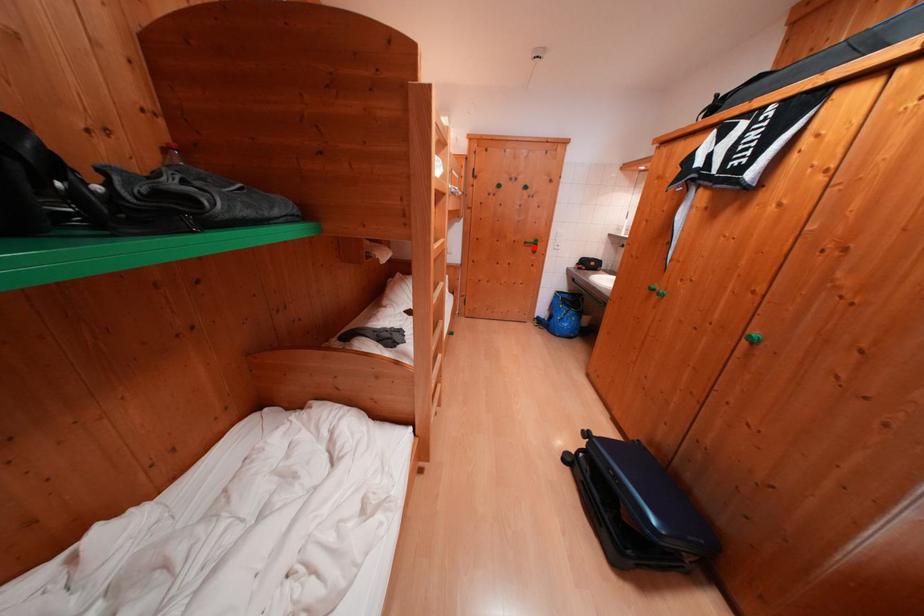
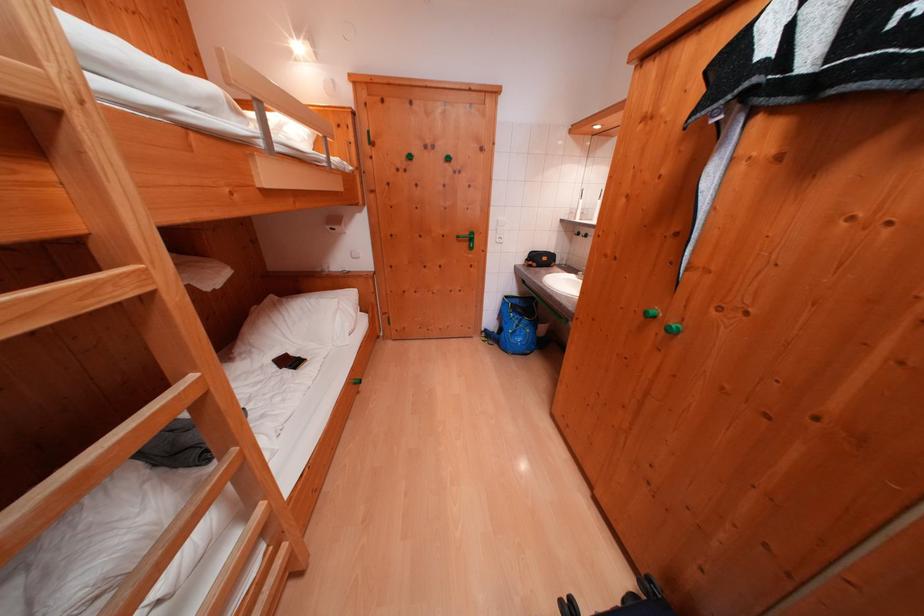
In the second image, find the point that corresponds to the highlighted location in the first image.

(466, 241)